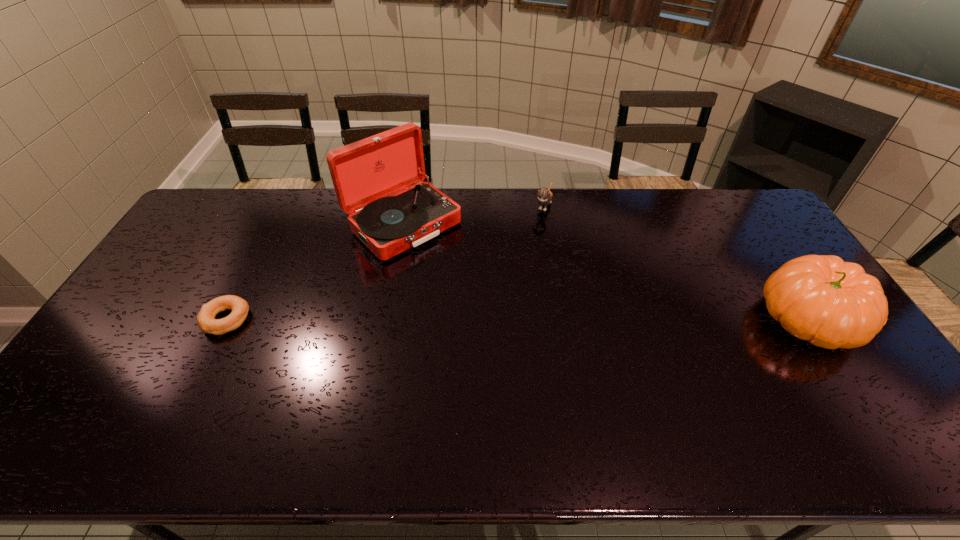
Where is `free region located on the front-facing side of the tallest object`? The image size is (960, 540). free region located on the front-facing side of the tallest object is located at coordinates (454, 268).

What are the coordinates of `free space located 0.230m on the front-facing side of the tallest object` in the screenshot? It's located at (482, 294).

Find the location of a particular element. The image size is (960, 540). vacant space located on the front-facing side of the kitten is located at coordinates (534, 231).

Locate an element on the screen. vacant position located 0.350m on the front-facing side of the kitten is located at coordinates (508, 281).

Identify the location of free space located on the front-facing side of the kitten. (520, 256).

Image resolution: width=960 pixels, height=540 pixels. I want to click on phonograph_record located in the far edge section of the desktop, so [x=364, y=173].

This screenshot has width=960, height=540. I want to click on kitten at the far edge, so click(x=545, y=195).

Locate an element on the screen. The height and width of the screenshot is (540, 960). object present at the right edge is located at coordinates pyautogui.click(x=832, y=304).

Image resolution: width=960 pixels, height=540 pixels. Identify the location of blank space at the far edge of the desktop. (330, 216).

This screenshot has height=540, width=960. I want to click on vacant space at the near edge of the desktop, so tap(658, 386).